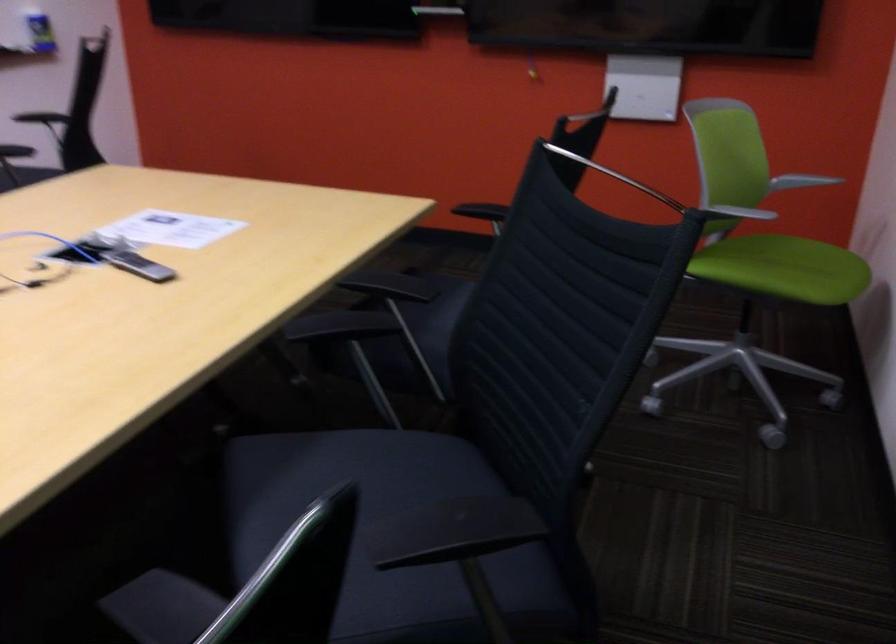
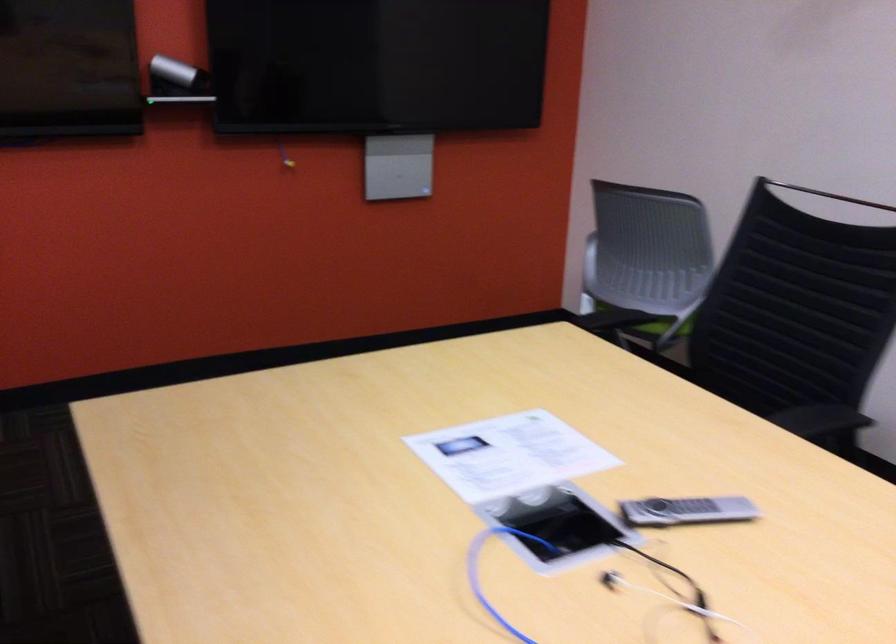
In the second image, find the point that corresponds to point 143,272 in the first image.

(686, 511)